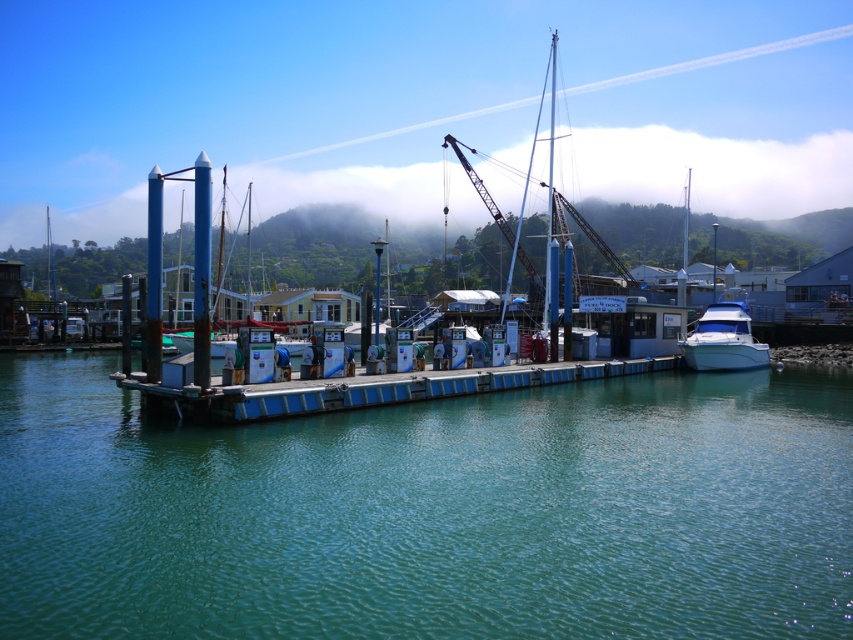
Question: Is teal glossy water at center bigger than foggy misty hillside at upper center?

Choices:
 (A) no
 (B) yes

Answer: (A)

Question: Can you confirm if teal glossy water at center is thinner than white glossy boat at right?

Choices:
 (A) no
 (B) yes

Answer: (A)

Question: Which of the following is the closest to the observer?

Choices:
 (A) (747, 326)
 (B) (0, 204)
 (C) (401, 381)

Answer: (C)

Question: Which point appears farthest from the camera in this image?

Choices:
 (A) [202, 529]
 (B) [718, 312]
 (C) [654, 172]

Answer: (C)

Question: Is blue painted wood dock at center to the right of white glossy boat at right from the viewer's perspective?

Choices:
 (A) no
 (B) yes

Answer: (A)

Question: Which object is farther from the camera taking this photo?

Choices:
 (A) blue painted wood dock at center
 (B) teal glossy water at center

Answer: (A)